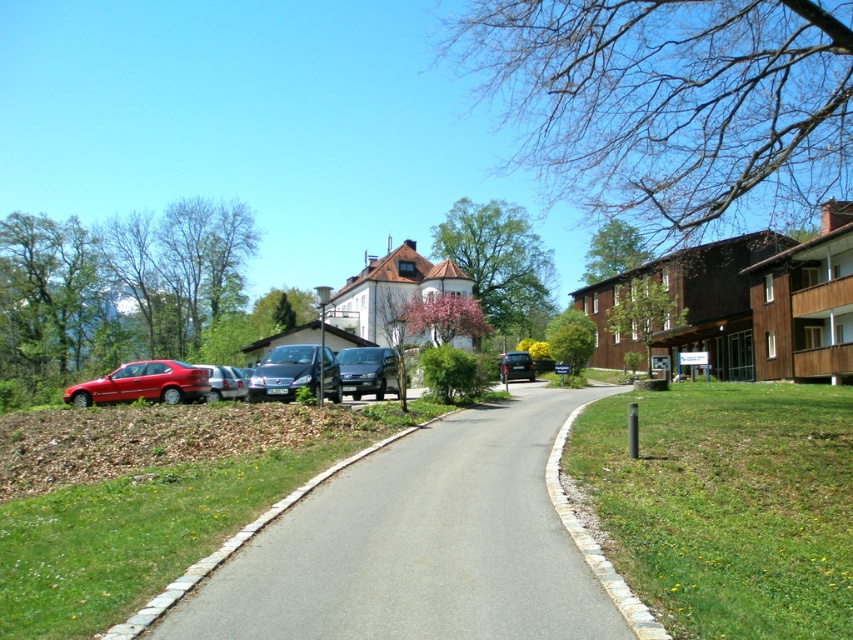
Does asphalt at center appear on the right side of metallic silver sedan at left?

Correct, you'll find asphalt at center to the right of metallic silver sedan at left.

At what (x,y) coordinates should I click in order to perform the action: click on asphalt at center. Please return your answer as a coordinate pair (x, y). The height and width of the screenshot is (640, 853). Looking at the image, I should click on (419, 545).

Measure the distance between point (422,552) and camera.

They are 23.82 feet apart.

Find the location of a particular element. This screenshot has width=853, height=640. asphalt at center is located at coordinates (419, 545).

Which is more to the right, asphalt at center or metallic silver sedan at center?

metallic silver sedan at center

Can you confirm if asphalt at center is positioned below metallic silver sedan at center?

Indeed, asphalt at center is positioned under metallic silver sedan at center.

Which is behind, point (519, 563) or point (529, 360)?

The point (529, 360) is more distant.

Find the location of a particular element. The width and height of the screenshot is (853, 640). asphalt at center is located at coordinates pyautogui.click(x=419, y=545).

Can you confirm if shiny silver van at center-left is taller than matte black van at center?

No, shiny silver van at center-left is not taller than matte black van at center.

Is shiny silver van at center-left to the left of matte black van at center from the viewer's perspective?

Yes, shiny silver van at center-left is to the left of matte black van at center.

Does point (286, 390) come in front of point (399, 397)?

No, (286, 390) is further to viewer.

The height and width of the screenshot is (640, 853). I want to click on shiny silver van at center-left, so click(294, 372).